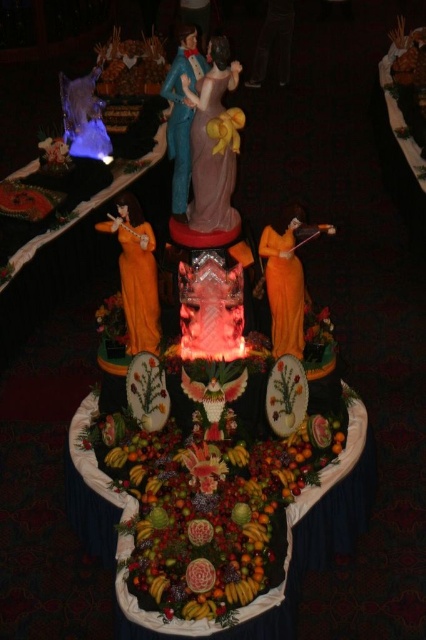
Which is above, orange fabric statue at center or orange fabric dress at center?

orange fabric statue at center

Who is positioned more to the right, orange fabric statue at center or orange fabric dress at center?

From the viewer's perspective, orange fabric dress at center appears more on the right side.

Describe the element at coordinates (135, 275) in the screenshot. This screenshot has height=640, width=426. I see `orange fabric statue at center` at that location.

Where is `orange fabric statue at center`? orange fabric statue at center is located at coordinates (135, 275).

Between orange fabric dress at center and black jeans at center, which one has more height?

black jeans at center

Can you confirm if orange fabric dress at center is thinner than black jeans at center?

Indeed, orange fabric dress at center has a lesser width compared to black jeans at center.

Where is `orange fabric dress at center`? Image resolution: width=426 pixels, height=640 pixels. orange fabric dress at center is located at coordinates (287, 280).

Between orange fabric statue at center and black jeans at center, which one appears on the right side from the viewer's perspective?

black jeans at center is more to the right.

This screenshot has height=640, width=426. Describe the element at coordinates (135, 275) in the screenshot. I see `orange fabric statue at center` at that location.

Is point (146, 234) less distant than point (276, 45)?

Yes, point (146, 234) is closer to viewer.

Locate an element on the screen. The height and width of the screenshot is (640, 426). orange fabric statue at center is located at coordinates (135, 275).